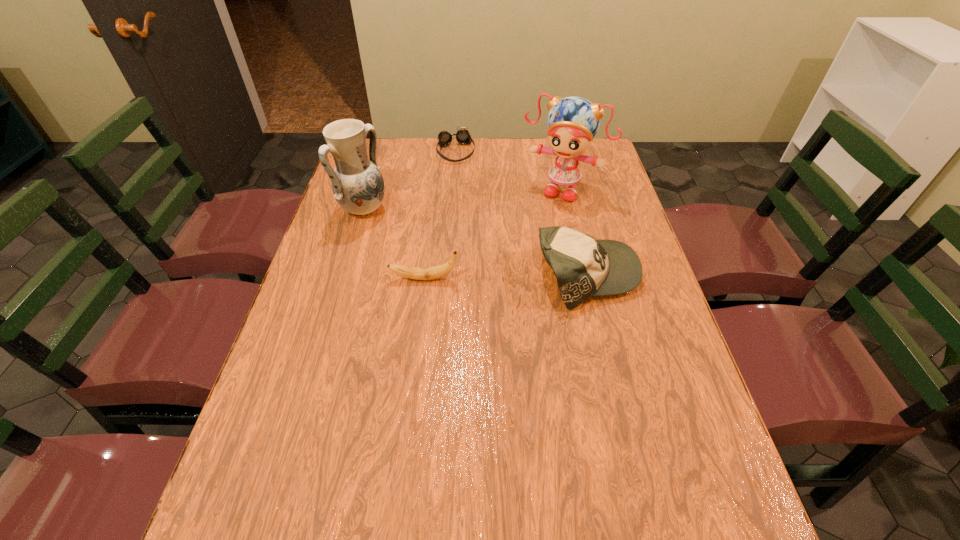
What are the coordinates of `vacant area situated 0.320m through the lenses of the goggles` in the screenshot? It's located at (474, 220).

Find the location of a particular element. vacant space positioned 0.140m on the face of the doll is located at coordinates (534, 229).

The width and height of the screenshot is (960, 540). I want to click on free point located 0.280m on the face of the doll, so click(518, 259).

Locate an element on the screen. This screenshot has width=960, height=540. free space located on the face of the doll is located at coordinates (530, 237).

What are the coordinates of `free space located 0.210m on either side of the pottery` in the screenshot? It's located at (435, 247).

Image resolution: width=960 pixels, height=540 pixels. Find the location of `free spot located 0.340m on either side of the pottery`. free spot located 0.340m on either side of the pottery is located at coordinates (471, 265).

Locate an element on the screen. The image size is (960, 540). free space located 0.160m on either side of the pottery is located at coordinates (421, 240).

This screenshot has height=540, width=960. I want to click on goggles that is at the far edge, so click(x=463, y=136).

At what (x,y) coordinates should I click in order to perform the action: click on doll positioned at the far edge. Please return your answer as a coordinate pair (x, y). The width and height of the screenshot is (960, 540). Looking at the image, I should click on (572, 122).

Locate an element on the screen. The height and width of the screenshot is (540, 960). object situated at the left edge is located at coordinates [357, 184].